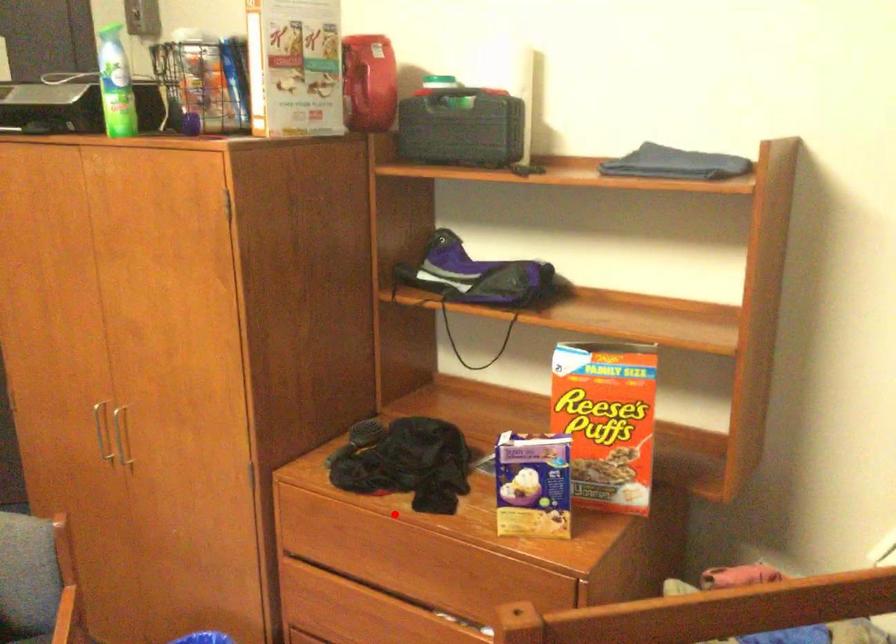
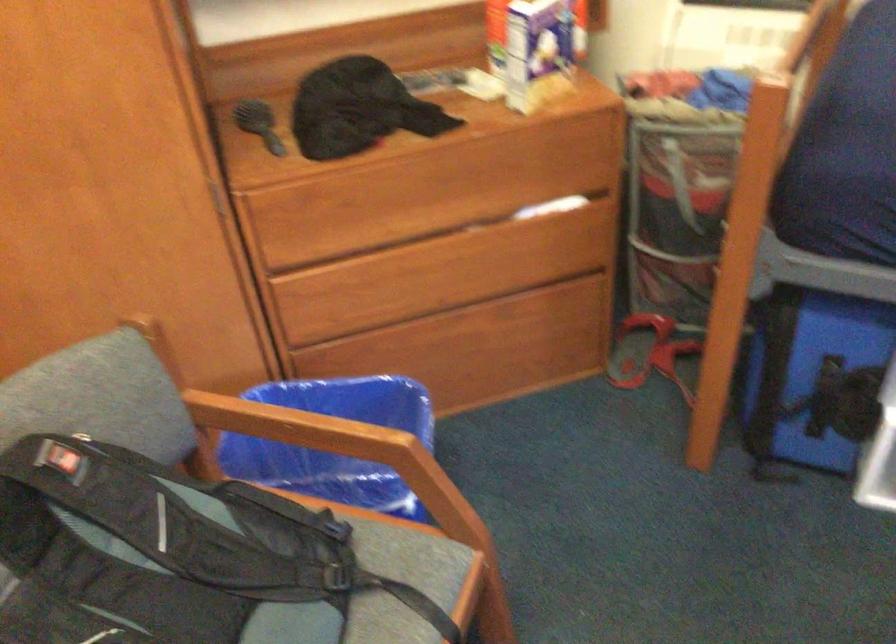
Question: I am providing you with two images of the same scene from different viewpoints. A red point is shown in image1. For the corresponding object point in image2, is it positioned nearer or farther from the camera?

Choices:
 (A) Nearer
 (B) Farther

Answer: (A)